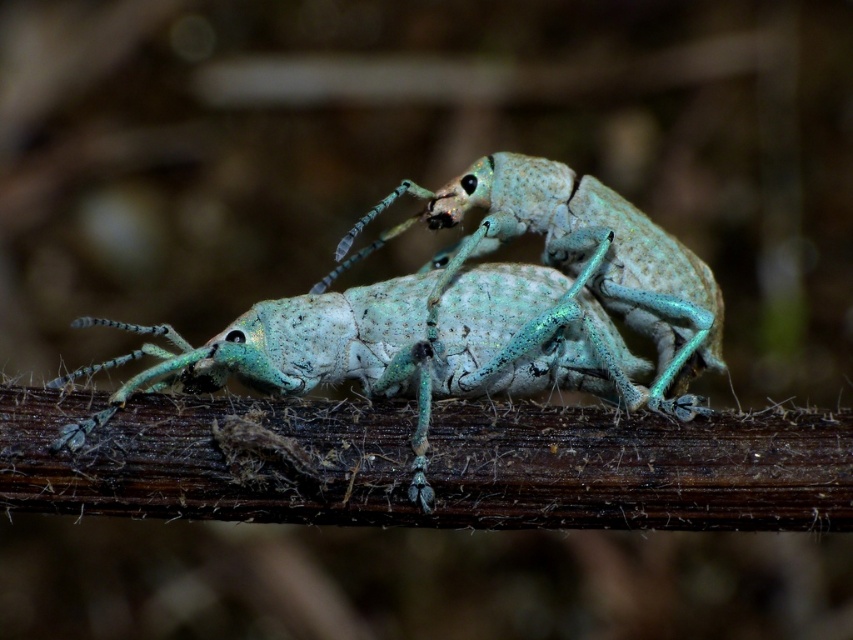
Can you confirm if matte green insect at center is wider than speckled light blue beetle at center?

Yes, matte green insect at center is wider than speckled light blue beetle at center.

Consider the image. Who is positioned more to the left, matte green insect at center or speckled light blue beetle at center?

matte green insect at center

This screenshot has width=853, height=640. Find the location of `matte green insect at center`. matte green insect at center is located at coordinates (427, 340).

At what (x,y) coordinates should I click in order to perform the action: click on matte green insect at center. Please return your answer as a coordinate pair (x, y). The height and width of the screenshot is (640, 853). Looking at the image, I should click on (427, 340).